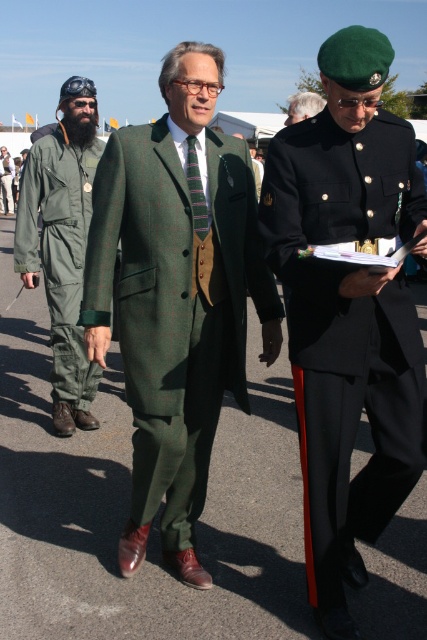
Question: Which point is closer to the camera taking this photo?

Choices:
 (A) (333, 492)
 (B) (6, 173)
 (C) (88, 160)
 (D) (125, 324)

Answer: (A)

Question: Is matte green jumpsuit at left to the right of green military uniform at left from the viewer's perspective?

Choices:
 (A) no
 (B) yes

Answer: (B)

Question: Is green wool suit at center above matte green jumpsuit at left?

Choices:
 (A) no
 (B) yes

Answer: (A)

Question: Among these points, which one is nearest to the camera?

Choices:
 (A) (56, 392)
 (B) (363, 241)
 (C) (158, 252)

Answer: (B)

Question: Does green wool suit at center appear on the right side of green military uniform at left?

Choices:
 (A) no
 (B) yes

Answer: (B)

Question: Which point is farther from the camera taking this photo?

Choices:
 (A) (8, 154)
 (B) (348, 362)

Answer: (A)